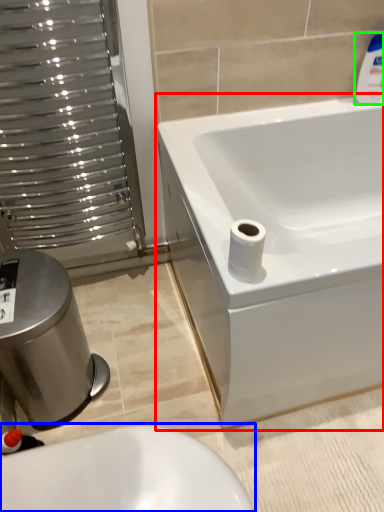
Question: Estimate the real-world distances between objects in this image. Which object is farther from bathtub (highlighted by a red box), toilet (highlighted by a blue box) or cleaning product (highlighted by a green box)?

Choices:
 (A) toilet
 (B) cleaning product

Answer: (A)